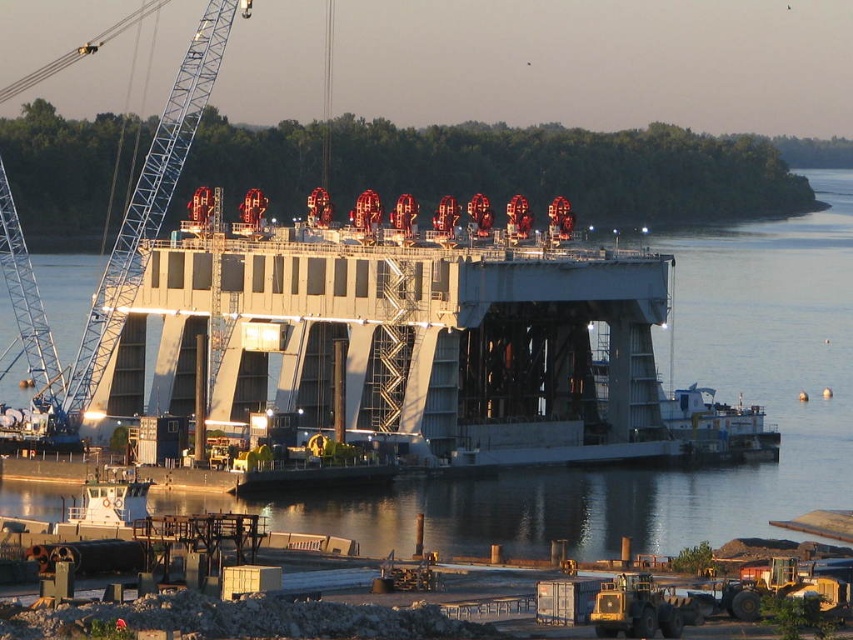
You are an engineer inspecting the dam. You need to lower a maintenance tool from the blue metallic crane at left to the metallic water at center. Is the crane positioned in a way that allows the tool to reach the water without obstruction?

Result: The metallic water at center is positioned under blue metallic crane at left, so yes, the crane can lower the tool directly onto the water without any obstruction.

You are an engineer inspecting the dam. You notice the metallic water at center and the blue metallic crane at left. Which object is closer to your current position?

The metallic water at center is closer to your current position because it is in front of the blue metallic crane at left.

You are a construction worker standing at the edge of the dam structure. You need to check the water level at the metallic water at center. Given that the safety protocol requires you to stay at least 500 feet away from the water, is your current position compliant with the safety protocol?

The metallic water at center and viewer are 603.19 feet apart from each other. Since 603.19 feet is greater than the required 500 feet, your current position is compliant with the safety protocol.